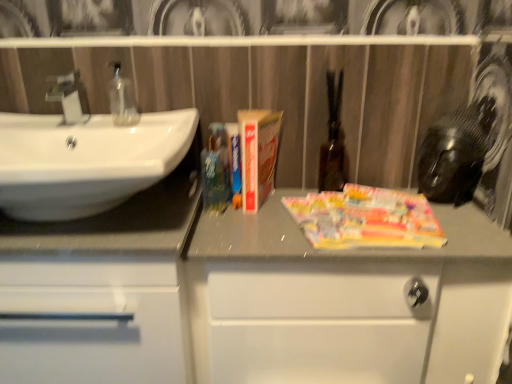
Question: Is transparent glass soap at left inside or outside of matte silver faucet at left?

Choices:
 (A) inside
 (B) outside

Answer: (B)

Question: Is transparent glass soap at left wider or thinner than matte silver faucet at left?

Choices:
 (A) thin
 (B) wide

Answer: (A)

Question: Which is farther from the white matte cabinet at center, the first bathroom cabinet positioned from the right?

Choices:
 (A) white glossy cabinet at left, which appears as the 1th bathroom cabinet when viewed from the left
 (B) transparent glass soap at left
 (C) white glossy sink at left
 (D) hardcover book at center
 (E) matte silver faucet at left

Answer: (E)

Question: Estimate the real-world distances between objects in this image. Which object is farther from the white glossy sink at left?

Choices:
 (A) white matte cabinet at center, the 2th bathroom cabinet in the left-to-right sequence
 (B) matte silver faucet at left
 (C) hardcover book at center
 (D) transparent glass soap at left
 (E) white glossy cabinet at left, which appears as the 1th bathroom cabinet when viewed from the left

Answer: (C)